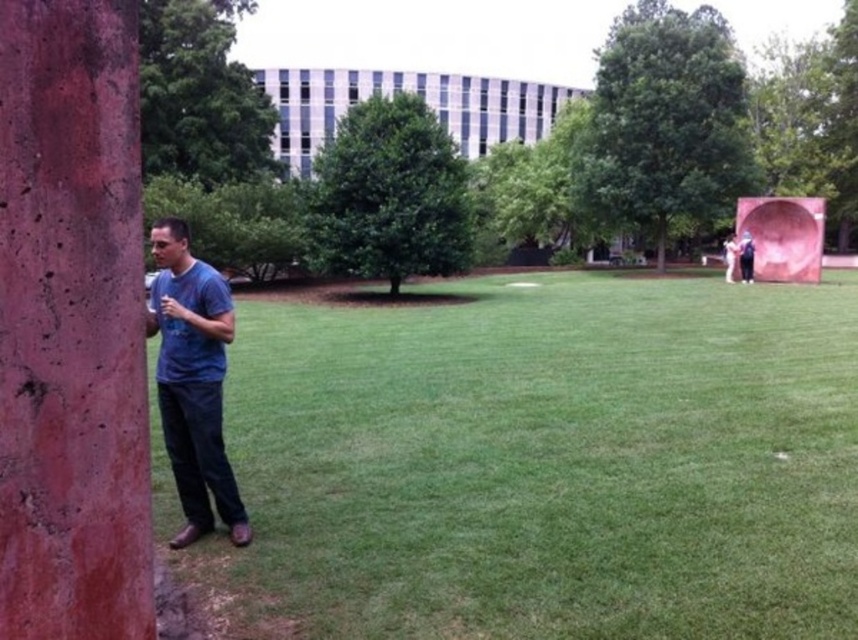
Is green grass at lower center to the right of matte blue shirt at right from the viewer's perspective?

In fact, green grass at lower center is to the left of matte blue shirt at right.

Who is more distant from viewer, (450, 410) or (742, 272)?

The point (742, 272) is behind.

Where is `green grass at lower center`? green grass at lower center is located at coordinates (554, 460).

Does rusty metal pole at left have a larger size compared to green leafy tree at center?

No.

Can you confirm if rusty metal pole at left is shorter than green leafy tree at center?

Yes, rusty metal pole at left is shorter than green leafy tree at center.

The image size is (858, 640). What do you see at coordinates (71, 324) in the screenshot?
I see `rusty metal pole at left` at bounding box center [71, 324].

The image size is (858, 640). What are the coordinates of `rusty metal pole at left` in the screenshot? It's located at (71, 324).

Based on the photo, does rusty metal pole at left have a lesser width compared to white matte statue at upper right?

Yes.

Which is more to the right, rusty metal pole at left or white matte statue at upper right?

From the viewer's perspective, white matte statue at upper right appears more on the right side.

Locate an element on the screen. Image resolution: width=858 pixels, height=640 pixels. rusty metal pole at left is located at coordinates (71, 324).

The image size is (858, 640). Find the location of `rusty metal pole at left`. rusty metal pole at left is located at coordinates (71, 324).